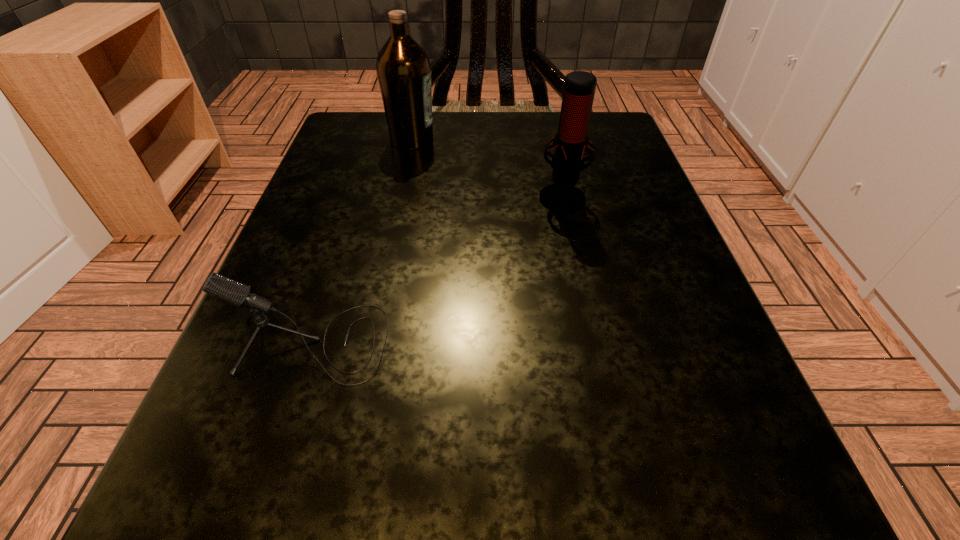
Find the location of a particular element. Image resolution: width=960 pixels, height=540 pixels. vacant space that is in between the nearest object and the farthest object is located at coordinates (362, 241).

The width and height of the screenshot is (960, 540). What are the coordinates of `free space between the olive oil and the shortest object` in the screenshot? It's located at (362, 241).

Find the location of `empty space between the rightmost object and the shortest object`. empty space between the rightmost object and the shortest object is located at coordinates (437, 269).

You are a GUI agent. You are given a task and a screenshot of the screen. Output one action in this format:
    pyautogui.click(x=<x>, y=<y>)
    Task: Click on the free spot between the left microphone and the right microphone
    
    Given the screenshot: What is the action you would take?
    pyautogui.click(x=437, y=269)

This screenshot has width=960, height=540. In order to click on empty location between the right microphone and the nearest object in this screenshot , I will do `click(437, 269)`.

Where is `free space between the shortest object and the olive oil`? The height and width of the screenshot is (540, 960). free space between the shortest object and the olive oil is located at coordinates (362, 241).

This screenshot has width=960, height=540. Find the location of `blank region between the shorter microphone and the farther microphone`. blank region between the shorter microphone and the farther microphone is located at coordinates (437, 269).

Identify the location of free space between the farthest object and the nearer microphone. (362, 241).

Image resolution: width=960 pixels, height=540 pixels. What are the coordinates of `the second closest object to the nearest object` in the screenshot? It's located at (403, 68).

Select which object is the closest to the shortest object. Please provide its 2D coordinates. Your answer should be formatted as a tuple, i.e. [(x, y)], where the tuple contains the x and y coordinates of a point satisfying the conditions above.

[(571, 140)]